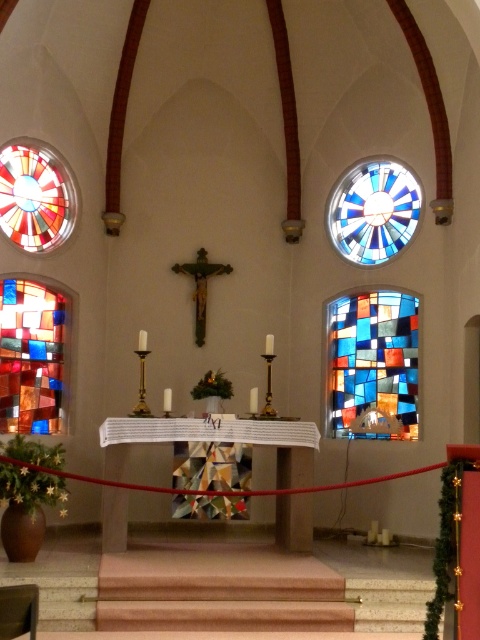
You are standing in the church facing the altar. Where is the stained glass window at right located relative to the crucifix?

The stained glass window at right is located to the right side of the crucifix, at point coordinates approximately 0.572 on the x axis and 0.777 on the y axis.

You are standing in the church and want to take a closer look at the stained glass windows. Which stained glass window, the stained glass window at right or the stained glass window at upper right, is nearer to you?

The stained glass window at right is closer to the viewer than stained glass window at upper right, so the stained glass window at right is nearer to you.

You are standing in the church facing the altar. There is a point labeled as point (372, 365) in the scene. Based on the description, which object does this point belong to?

The point 0.577, 0.777 corresponds to the stained glass window at right.